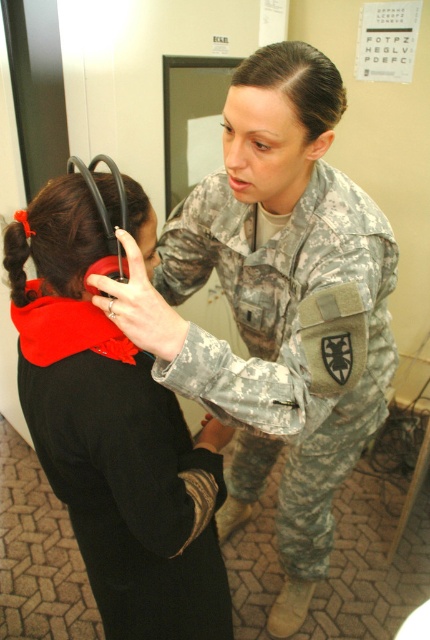
You are a medical student observing a patient examination. You notice two black objects in the scene. One is the black smooth hair at center and the other is the black fabric ponytail at upper left. Which object is closer to you?

The black smooth hair at center is closer to you because it is further to the viewer than the black fabric ponytail at upper left.

You are a medical robot in a clinic. You need to approach the point at coordinates point (300, 289) to deliver a medical kit. Your maximum reach is 1 meter. Can you reach the point from your current position?

The point (300, 289) is 1.11 meters away from the camera, so the medical robot cannot reach it with a maximum reach of 1 meter.